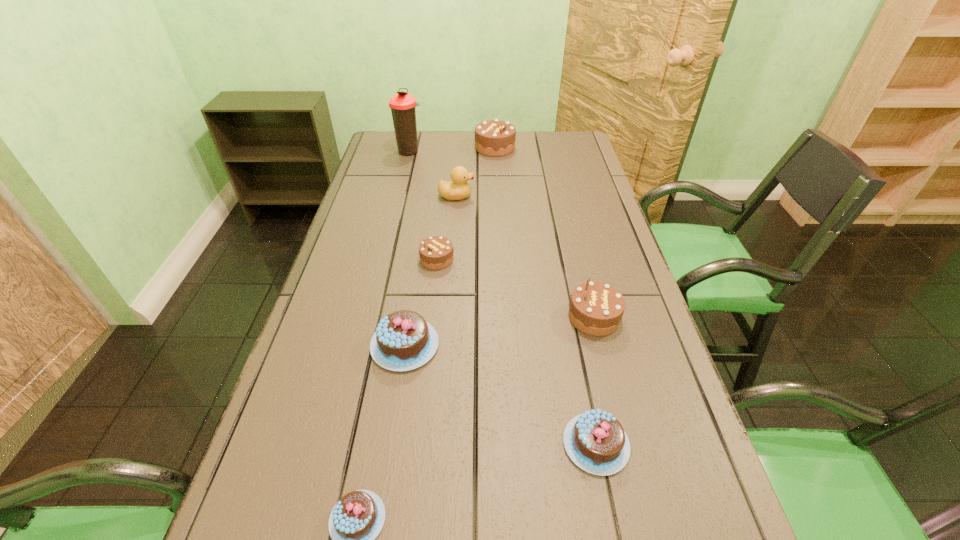
Locate an element on the screen. brown thermos bottle is located at coordinates (402, 105).

You are a GUI agent. You are given a task and a screenshot of the screen. Output one action in this format:
    pyautogui.click(x=<x>, y=<y>)
    Task: Click on the thermos bottle
    
    Given the screenshot: What is the action you would take?
    pyautogui.click(x=402, y=105)

Find the location of a particular element. the second brown chocolate cake from right to left is located at coordinates (495, 138).

This screenshot has width=960, height=540. In order to click on the third chocolate cake from right to left in this screenshot , I will do `click(495, 138)`.

This screenshot has width=960, height=540. What are the coordinates of `duckling` in the screenshot? It's located at (458, 189).

At what (x,y) coordinates should I click in order to perform the action: click on the second biggest brown chocolate cake. Please return your answer as a coordinate pair (x, y). This screenshot has width=960, height=540. Looking at the image, I should click on (596, 308).

Image resolution: width=960 pixels, height=540 pixels. I want to click on the nearest brown chocolate cake, so click(596, 308).

You are a GUI agent. You are given a task and a screenshot of the screen. Output one action in this format:
    pyautogui.click(x=<x>, y=<y>)
    Task: Click on the biggest pink chocolate cake
    The image size is (960, 540).
    Given the screenshot: What is the action you would take?
    pyautogui.click(x=403, y=341)

This screenshot has height=540, width=960. Find the location of `the smallest brown chocolate cake`. the smallest brown chocolate cake is located at coordinates (436, 252).

Identify the location of the fourth farthest object. (436, 252).